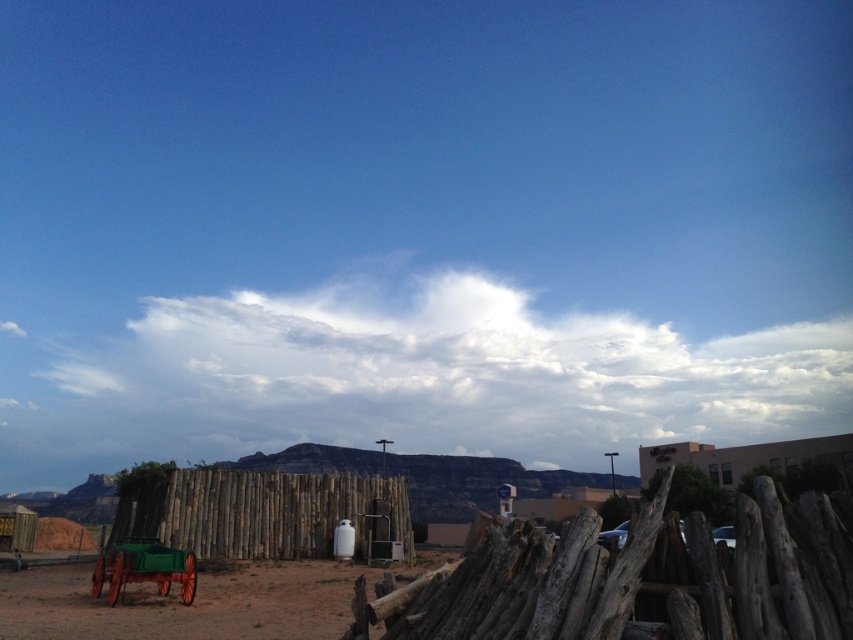
Is point (613, 404) positioned in front of point (245, 582)?

That is False.

Can you confirm if white fluffy cloud at upper center is positioned above brown dirt field at lower left?

Incorrect, white fluffy cloud at upper center is not positioned above brown dirt field at lower left.

Is point (744, 394) positioned in front of point (271, 568)?

No, it is behind (271, 568).

This screenshot has width=853, height=640. I want to click on white fluffy cloud at upper center, so click(x=410, y=376).

Consider the image. Who is higher up, brown dirt field at lower left or wooden fence at center?

Positioned higher is wooden fence at center.

Is brown dirt field at lower left behind wooden fence at center?

No, it is not.

Where is `brown dirt field at lower left`? brown dirt field at lower left is located at coordinates (184, 605).

Which is more to the left, driftwood at center or brown dirt field at lower left?

Positioned to the left is brown dirt field at lower left.

Is point (689, 563) closer to viewer compared to point (339, 564)?

Yes, point (689, 563) is in front of point (339, 564).

Between point (616, 634) and point (80, 572), which one is positioned behind?

Positioned behind is point (80, 572).

Where is `driftwood at center`? driftwood at center is located at coordinates (640, 577).